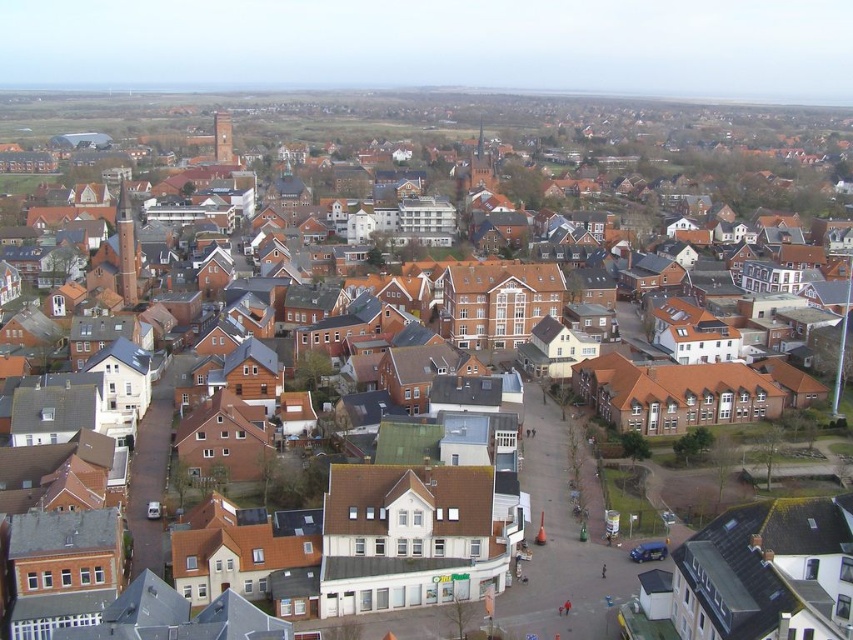
Is point (125, 218) closer to camera compared to point (229, 157)?

Yes, point (125, 218) is closer to viewer.

Is light brown wooden tower at center-left positioned at the back of brick tower at upper left?

No, it is not.

Is point (123, 195) more distant than point (225, 150)?

No, it is not.

This screenshot has height=640, width=853. In order to click on light brown wooden tower at center-left in this screenshot , I will do `click(126, 248)`.